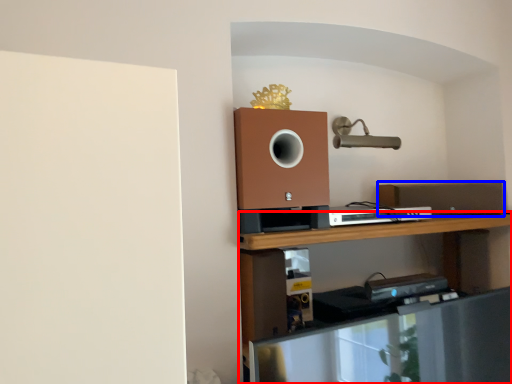
Question: Which of the following is the closest to the observer, shelf (highlighted by a red box) or speaker (highlighted by a blue box)?

Choices:
 (A) shelf
 (B) speaker

Answer: (A)